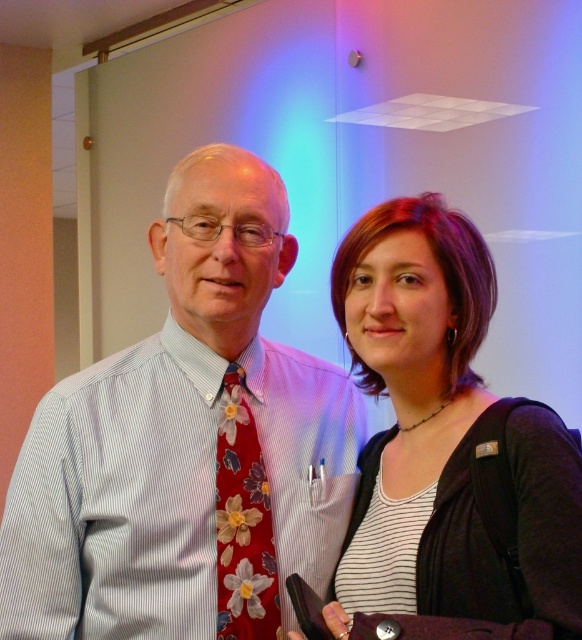
You are a photographer at the event and want to take a closeup of the floral pattern on the red tie. You have a camera with a zoom lens that can focus on a specific point. The point you need to focus on is given as point (186, 444). Where exactly should you aim your camera to capture the floral pattern on the red tie?

The point (186, 444) is on the floral tie at center, so you should aim your camera at the floral tie at center to capture the floral pattern on the red tie.

Consider the image. You are organizing a photo shoot and need to decide which object to place in the foreground for better visibility. Based on their sizes, which one between the matte black backpack at center and the floral silk tie at center should be chosen?

The matte black backpack at center is much taller than the floral silk tie at center, so it should be chosen for the foreground due to its larger size providing better visibility.

You are a delivery person holding a package that needs to be placed exactly where the matte black backpack at center is currently located. However, you must not move the backpack. Can you fit the package there without moving the backpack?

The matte black backpack at center is 36.39 inches away from the viewer, so if the package can be placed at that distance without disturbing the backpack, it should be possible. However, the exact feasibility depends on the package size and positioning.